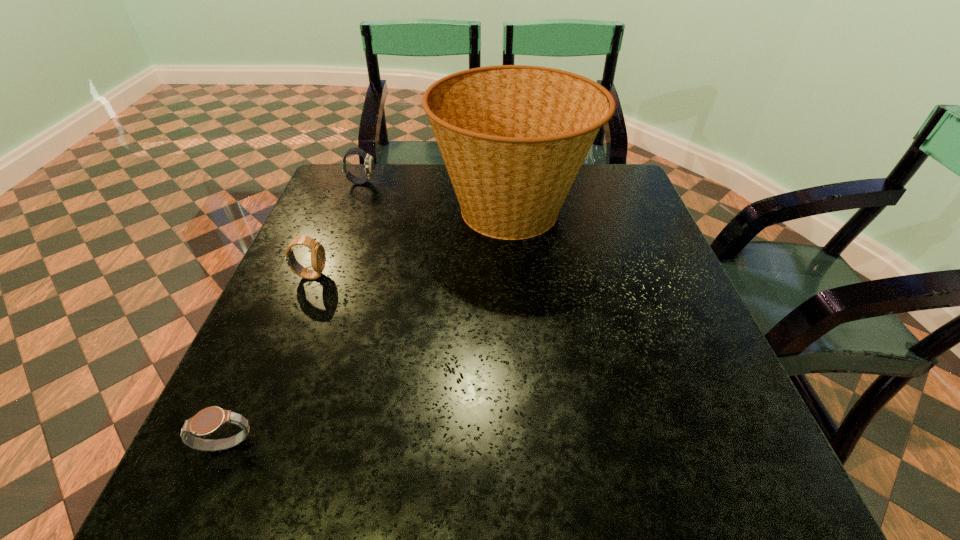
What are the coordinates of `free location that satisfies the following two spatial constraints: 1. on the face of the farthest watch; 2. on the back side of the tallest object` in the screenshot? It's located at (350, 210).

The width and height of the screenshot is (960, 540). Find the location of `free space that satisfies the following two spatial constraints: 1. on the face of the basket; 2. on the left side of the farthest watch`. free space that satisfies the following two spatial constraints: 1. on the face of the basket; 2. on the left side of the farthest watch is located at coordinates (350, 210).